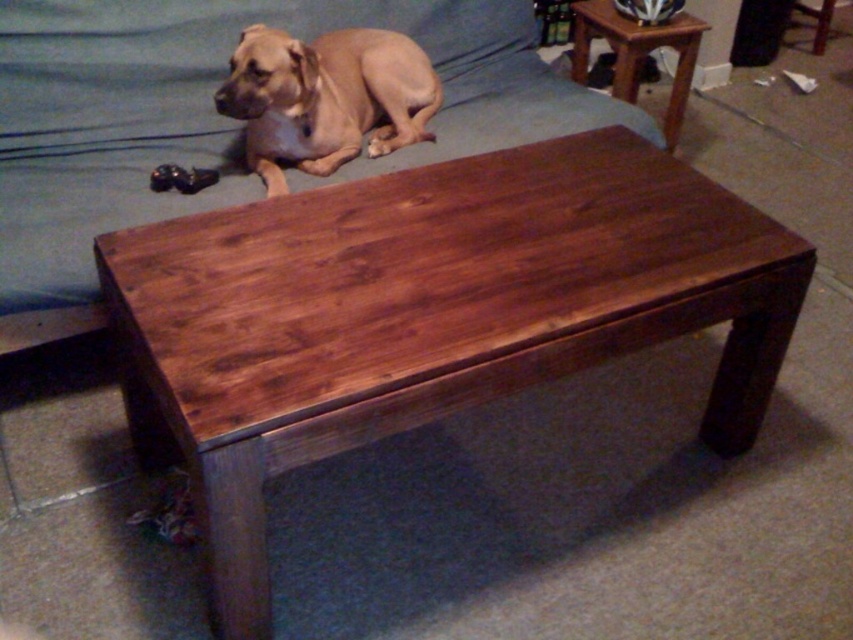
Question: Among these objects, which one is farthest from the camera?

Choices:
 (A) mahogany wood side table at upper right
 (B) brown wood couch at center
 (C) light brown fur at upper center
 (D) dark brown wood table at center

Answer: (A)

Question: Does dark brown wood table at center appear on the right side of light brown fur at upper center?

Choices:
 (A) yes
 (B) no

Answer: (A)

Question: From the image, what is the correct spatial relationship of dark brown wood table at center in relation to light brown fur at upper center?

Choices:
 (A) left
 (B) right

Answer: (B)

Question: Which object is positioned closest to the brown wood couch at center?

Choices:
 (A) light brown fur at upper center
 (B) dark brown wood table at center

Answer: (A)

Question: Does brown wood couch at center appear on the right side of light brown fur at upper center?

Choices:
 (A) no
 (B) yes

Answer: (A)

Question: Among these objects, which one is farthest from the camera?

Choices:
 (A) brown wood couch at center
 (B) dark brown wood table at center

Answer: (A)